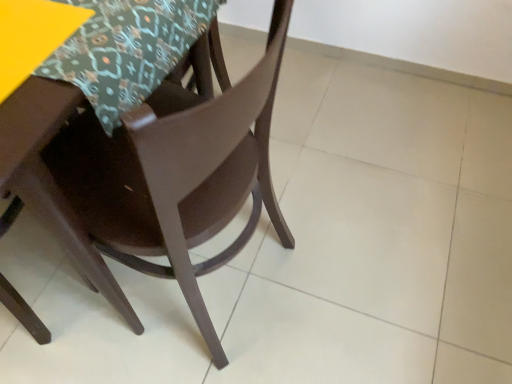
Question: Relative to yellow matte table at upper left, is matte brown chair at center in front or behind?

Choices:
 (A) behind
 (B) front

Answer: (B)

Question: Would you say matte brown chair at center is to the left or to the right of yellow matte table at upper left in the picture?

Choices:
 (A) left
 (B) right

Answer: (B)

Question: Based on their relative distances, which object is farther from the patterned fabric tablecloth at upper left?

Choices:
 (A) matte brown chair at center
 (B) yellow matte table at upper left

Answer: (A)

Question: Estimate the real-world distances between objects in this image. Which object is closer to the patterned fabric tablecloth at upper left?

Choices:
 (A) matte brown chair at center
 (B) yellow matte table at upper left

Answer: (B)